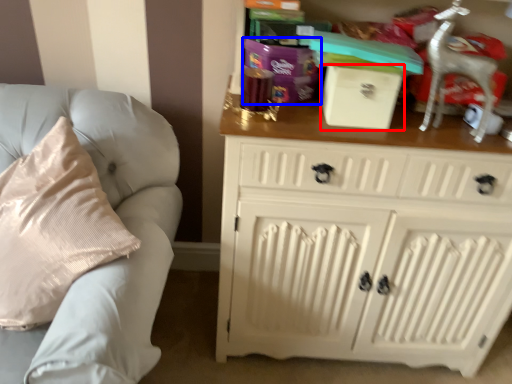
Question: Among these objects, which one is farthest to the camera, box (highlighted by a red box) or gift (highlighted by a blue box)?

Choices:
 (A) box
 (B) gift

Answer: (B)